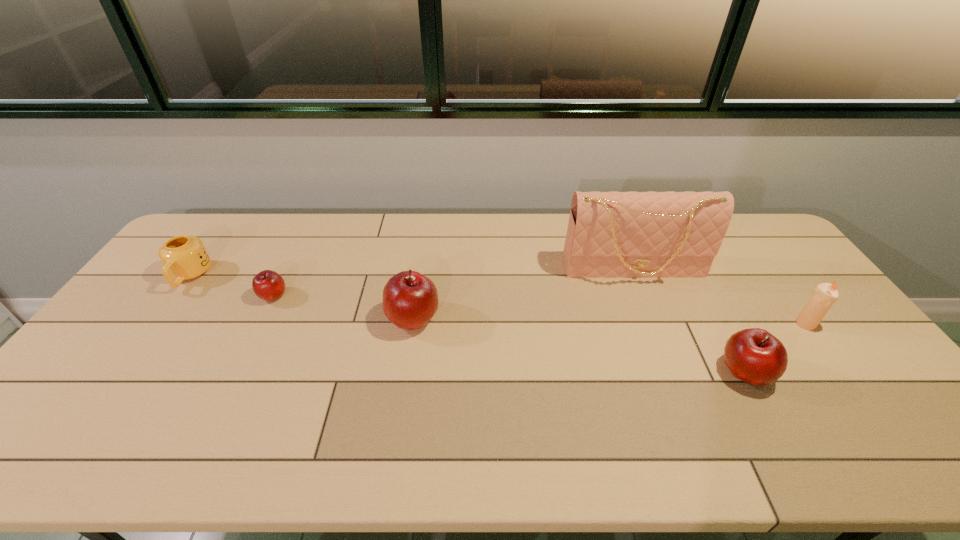
Locate an element on the screen. The image size is (960, 540). vacant spot for a new apple to ensure equal spacing is located at coordinates (569, 343).